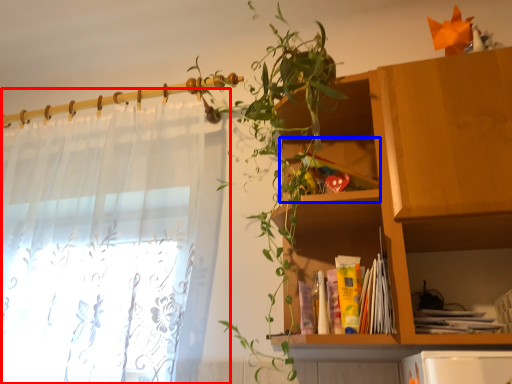
Question: Which of the following is the farthest to the observer, curtain (highlighted by a red box) or cabinet (highlighted by a blue box)?

Choices:
 (A) curtain
 (B) cabinet

Answer: (B)